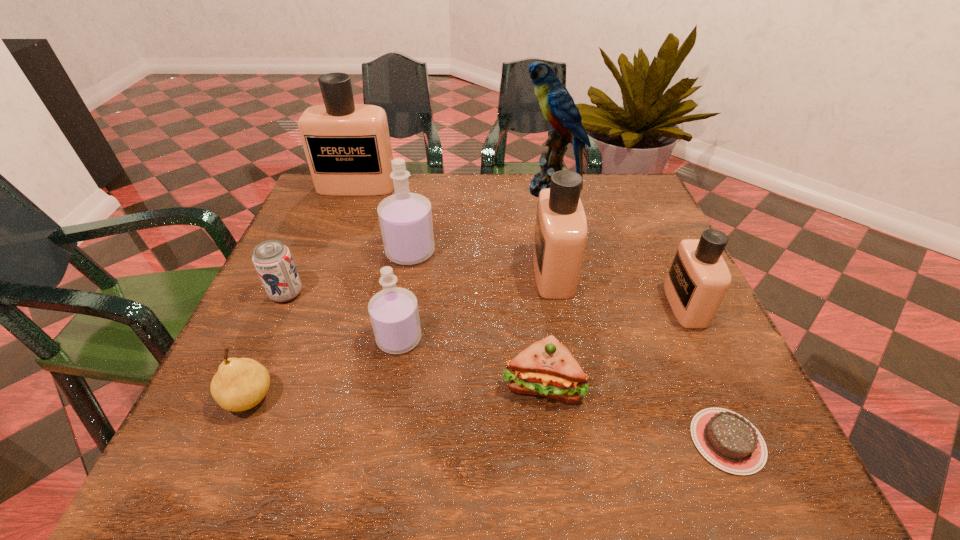
In order to click on vacant space situated on the front label of the second smallest beige perfume in this screenshot , I will do `click(382, 272)`.

Identify the location of free space located 0.250m on the back of the bigger purple perfume. (422, 184).

Identify the location of vacant region located on the left of the smaller purple perfume. The image size is (960, 540). (340, 339).

Identify the location of vacant point located on the front label of the smallest beige perfume. The image size is (960, 540). (597, 305).

This screenshot has height=540, width=960. In order to click on vacant region located 0.400m on the front label of the smallest beige perfume in this screenshot , I will do `click(477, 305)`.

Find the location of a particular element. This screenshot has width=960, height=540. free spot located 0.200m on the front label of the smallest beige perfume is located at coordinates (573, 305).

Find the location of a particular element. free space located 0.260m on the back of the beer can is located at coordinates (323, 214).

This screenshot has height=540, width=960. Identify the location of vacant space located on the right of the pear. (456, 398).

The height and width of the screenshot is (540, 960). I want to click on vacant space located on the left of the sandwich, so click(x=395, y=383).

You are a GUI agent. You are given a task and a screenshot of the screen. Output one action in this format:
    pyautogui.click(x=<x>, y=<y>)
    Task: Click on the vacant space located on the left of the shortest object
    Image resolution: width=960 pixels, height=540 pixels.
    Given the screenshot: What is the action you would take?
    pyautogui.click(x=535, y=441)